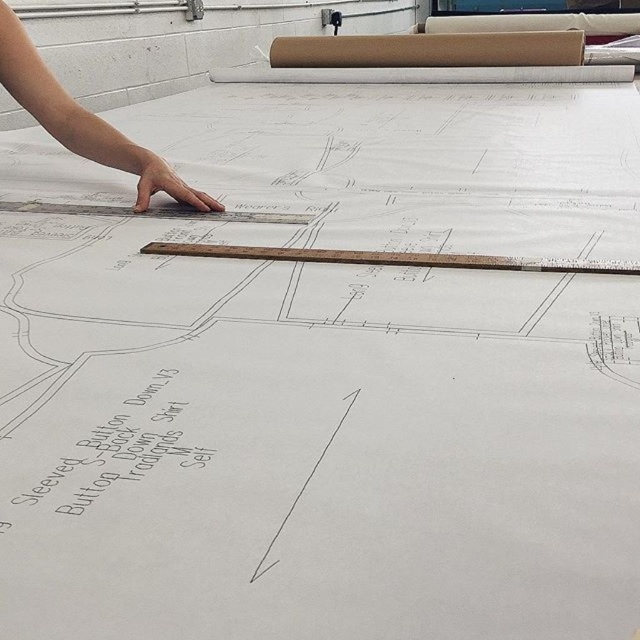
Is skinny hand at upper left further to camera compared to wooden ruler at center?

Yes, skinny hand at upper left is behind wooden ruler at center.

Is skinny hand at upper left wider than wooden ruler at center?

No.

At what (x,y) coordinates should I click in order to perform the action: click on skinny hand at upper left. Please return your answer as a coordinate pair (x, y). Looking at the image, I should click on (83, 122).

Image resolution: width=640 pixels, height=640 pixels. In order to click on skinny hand at upper left in this screenshot , I will do (83, 122).